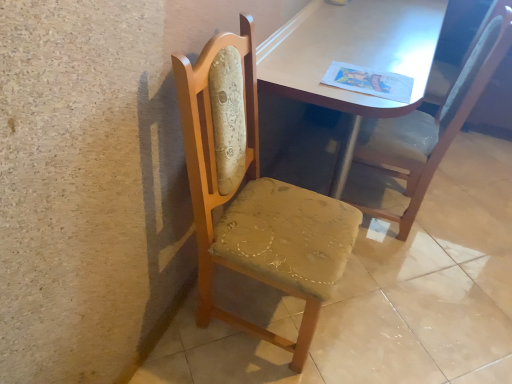
The height and width of the screenshot is (384, 512). Find the location of `free space in front of wooden chair at right, marked as the 2th chair in a left-to-right arrangement`. free space in front of wooden chair at right, marked as the 2th chair in a left-to-right arrangement is located at coordinates (412, 281).